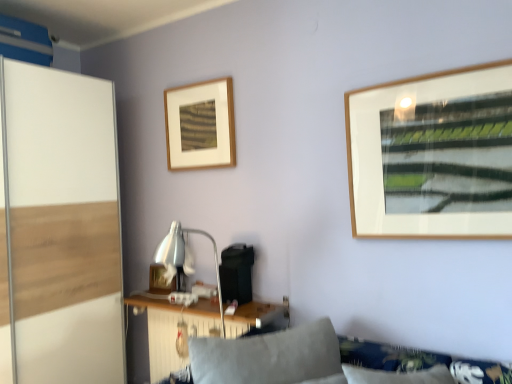
Question: Is wooden table at lower center facing towards wooden picture frame at center, which is the first picture frame from left to right?

Choices:
 (A) no
 (B) yes

Answer: (A)

Question: Considering the relative positions of wooden table at lower center and wooden picture frame at center, which is the first picture frame from left to right, in the image provided, is wooden table at lower center in front of wooden picture frame at center, which is the first picture frame from left to right,?

Choices:
 (A) no
 (B) yes

Answer: (B)

Question: From the image's perspective, is wooden table at lower center located beneath wooden picture frame at center, which is the first picture frame from left to right?

Choices:
 (A) yes
 (B) no

Answer: (A)

Question: Does wooden table at lower center appear on the right side of wooden picture frame at center, the second picture frame viewed from the front?

Choices:
 (A) yes
 (B) no

Answer: (A)

Question: Is wooden picture frame at center, which is the first picture frame from left to right, inside wooden table at lower center?

Choices:
 (A) no
 (B) yes

Answer: (A)

Question: Does wooden table at lower center have a lesser width compared to wooden picture frame at center, the 1th picture frame viewed from the back?

Choices:
 (A) yes
 (B) no

Answer: (B)

Question: Is wooden picture frame at center, arranged as the first picture frame when ordered from the bottom, in contact with soft gray cushion at lower center?

Choices:
 (A) yes
 (B) no

Answer: (B)

Question: Can you confirm if wooden picture frame at center, which is the first picture frame from left to right, is shorter than soft gray cushion at lower center?

Choices:
 (A) yes
 (B) no

Answer: (A)

Question: Considering the relative sizes of wooden picture frame at center, the second picture frame viewed from the front, and soft gray cushion at lower center in the image provided, is wooden picture frame at center, the second picture frame viewed from the front, taller than soft gray cushion at lower center?

Choices:
 (A) yes
 (B) no

Answer: (B)

Question: From the image's perspective, is wooden picture frame at center, which ranks as the second picture frame in top-to-bottom order, under soft gray cushion at lower center?

Choices:
 (A) yes
 (B) no

Answer: (B)

Question: Is wooden picture frame at center, which is the first picture frame from left to right, completely or partially outside of soft gray cushion at lower center?

Choices:
 (A) yes
 (B) no

Answer: (A)

Question: Is wooden picture frame at center, placed as the second picture frame when sorted from right to left, oriented towards soft gray cushion at lower center?

Choices:
 (A) no
 (B) yes

Answer: (A)

Question: Are white glossy screen door at left and soft gray cushion at lower center far apart?

Choices:
 (A) yes
 (B) no

Answer: (A)